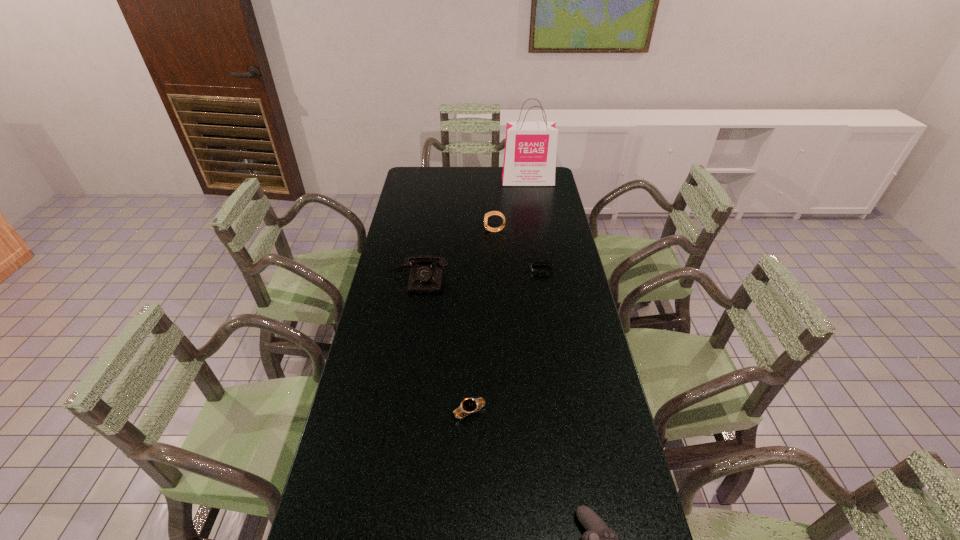
You are a GUI agent. You are given a task and a screenshot of the screen. Output one action in this format:
    pyautogui.click(x=<x>, y=<y>)
    Task: Click on the wristband that is positioned at the right edge
    The image size is (960, 540).
    Given the screenshot: What is the action you would take?
    pyautogui.click(x=534, y=271)

Identify the location of object situated at the far right corner. (530, 147).

This screenshot has height=540, width=960. In order to click on vacant position at the far edge of the desktop in this screenshot , I will do `click(441, 173)`.

Where is `vacant space at the left edge`? The image size is (960, 540). vacant space at the left edge is located at coordinates (355, 390).

Find the location of a particular element. vacant space at the right edge of the desktop is located at coordinates (588, 437).

Where is `vacant space at the far right corner of the desktop`? This screenshot has width=960, height=540. vacant space at the far right corner of the desktop is located at coordinates coord(527,191).

Find the location of a particular element. This screenshot has width=960, height=540. blank region between the shopping bag and the shortest object is located at coordinates (535, 225).

Identify the location of free space that is in between the wristband and the leftmost object. (480, 273).

In order to click on free area in between the wristband and the leftmost object in this screenshot , I will do `click(480, 273)`.

Where is `unoccupied position between the shortest object and the shopping bag`? unoccupied position between the shortest object and the shopping bag is located at coordinates (535, 225).